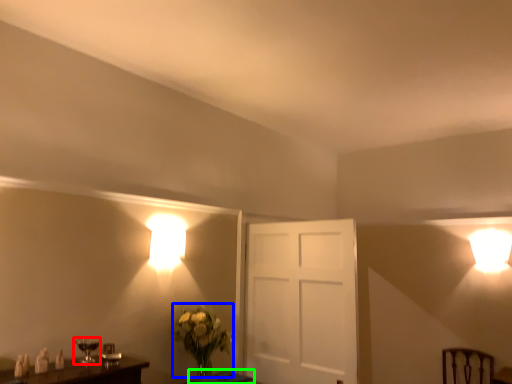
Question: Which object is the farthest from table lamp (highlighted by a red box)? Choose among these: floral arrangement (highlighted by a blue box) or table (highlighted by a green box).

Choices:
 (A) floral arrangement
 (B) table

Answer: (B)